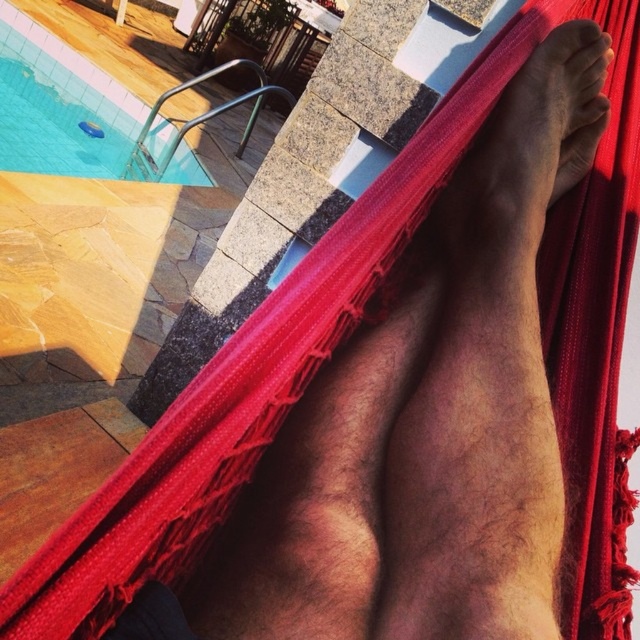
Question: In this image, where is dark skin foot at upper right located relative to blue glossy water at upper left?

Choices:
 (A) left
 (B) right

Answer: (B)

Question: Does dark skin foot at upper right have a smaller size compared to blue glossy water at upper left?

Choices:
 (A) yes
 (B) no

Answer: (A)

Question: Which object is farther from the camera taking this photo?

Choices:
 (A) dark skin foot at upper right
 (B) blue glossy water at upper left

Answer: (B)

Question: Does dark skin foot at upper right have a greater width compared to blue glossy water at upper left?

Choices:
 (A) no
 (B) yes

Answer: (A)